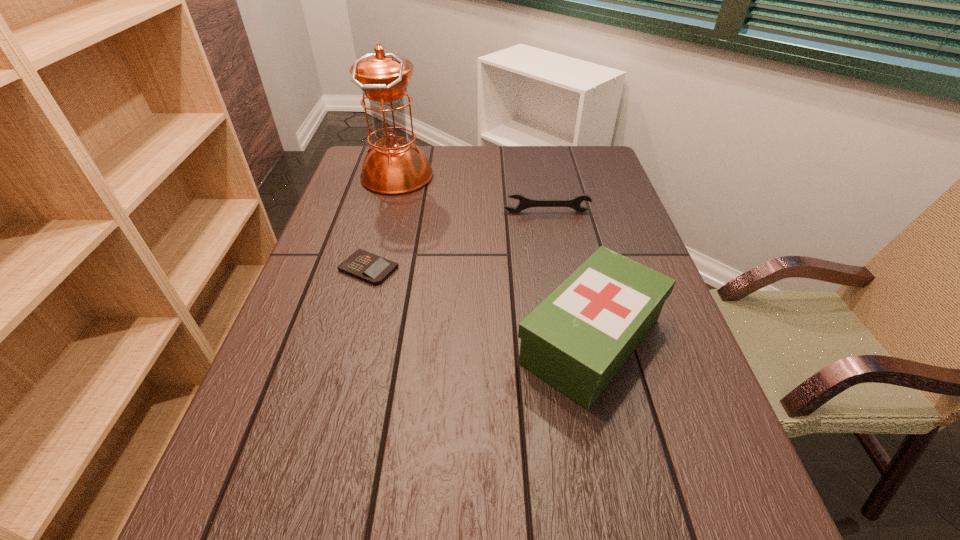
At what (x,y) coordinates should I click in order to perform the action: click on object that can be found as the second closest to the third tallest object. Please return your answer as a coordinate pair (x, y). Looking at the image, I should click on (577, 339).

Identify the location of object that ranks as the closest to the calculator. The image size is (960, 540). (394, 165).

Where is `free space that satisfies the following two spatial constraints: 1. on the open ends of the third shortest object; 2. on the left side of the wrench`? This screenshot has width=960, height=540. free space that satisfies the following two spatial constraints: 1. on the open ends of the third shortest object; 2. on the left side of the wrench is located at coordinates (572, 341).

This screenshot has width=960, height=540. I want to click on free space that satisfies the following two spatial constraints: 1. on the open ends of the wrench; 2. on the left side of the first-aid kit, so click(x=572, y=341).

Locate an element on the screen. vacant space that satisfies the following two spatial constraints: 1. on the open ends of the second farthest object; 2. on the left side of the first-aid kit is located at coordinates (572, 341).